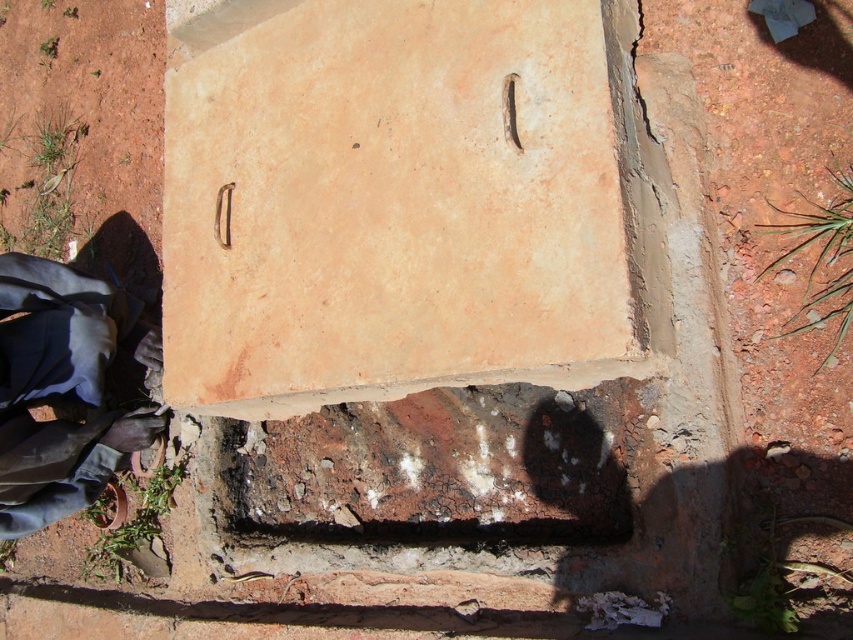
Between point (258, 134) and point (70, 294), which one is positioned in front?

Point (258, 134)

Which of these two, matte clay brick at center or dark blue fabric at lower left, stands shorter?

With less height is dark blue fabric at lower left.

The width and height of the screenshot is (853, 640). Identify the location of matte clay brick at center. (408, 205).